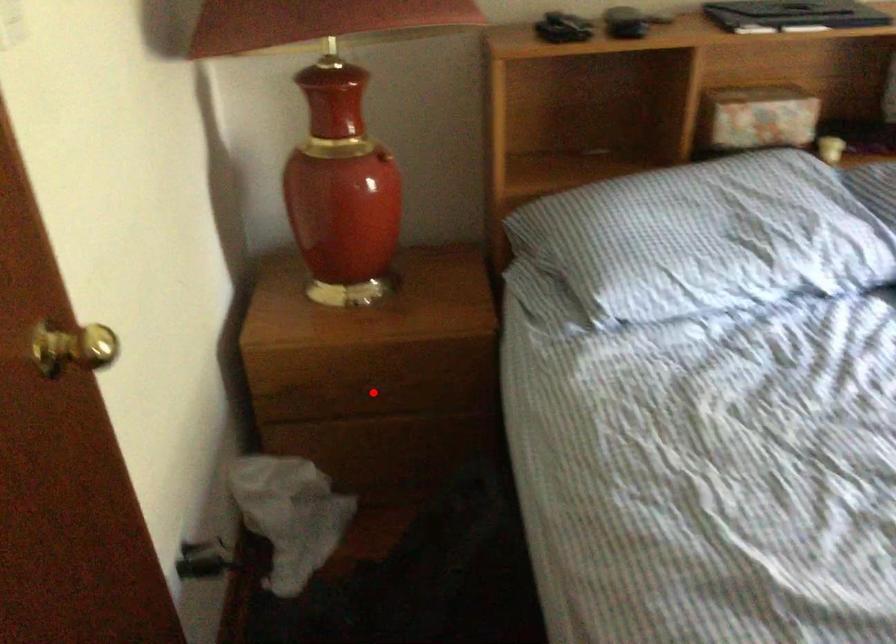
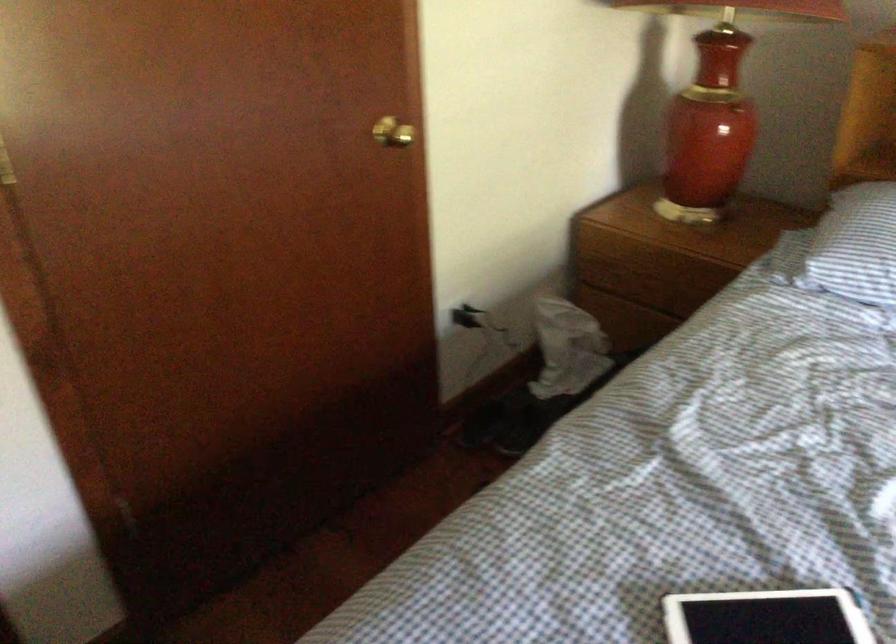
Question: I am providing you with two images of the same scene from different viewpoints. Image1 has a red point marked. In image2, the corresponding 3D location appears at what relative position? Reply with the corresponding letter.

Choices:
 (A) Closer
 (B) Farther

Answer: (B)